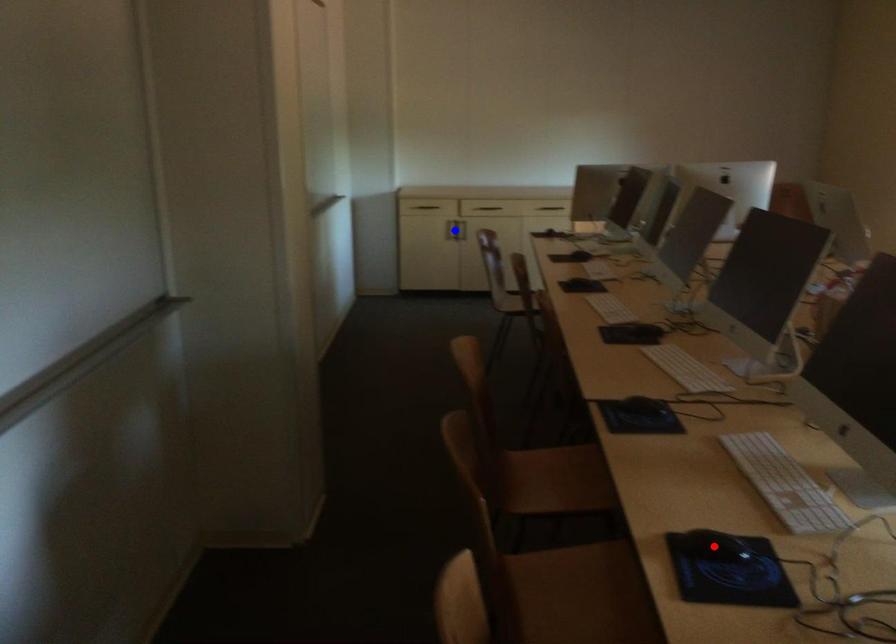
Question: In the image, two points are highlighted. Which point is nearer to the camera? Reply with the corresponding letter.

Choices:
 (A) blue point
 (B) red point

Answer: (B)